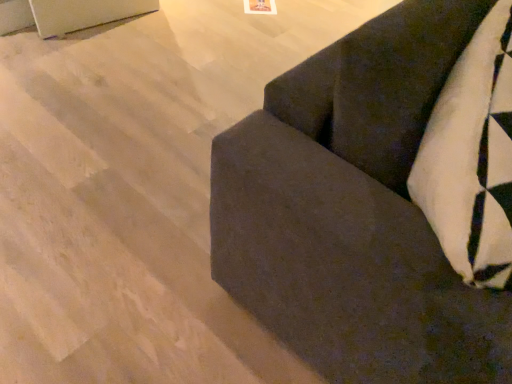
What do you see at coordinates (355, 212) in the screenshot?
I see `dark gray fabric couch at upper right` at bounding box center [355, 212].

Locate an element on the screen. The image size is (512, 384). dark gray fabric couch at upper right is located at coordinates (355, 212).

At what (x,y) coordinates should I click in order to perform the action: click on dark gray fabric couch at upper right. Please return your answer as a coordinate pair (x, y). The width and height of the screenshot is (512, 384). Looking at the image, I should click on (355, 212).